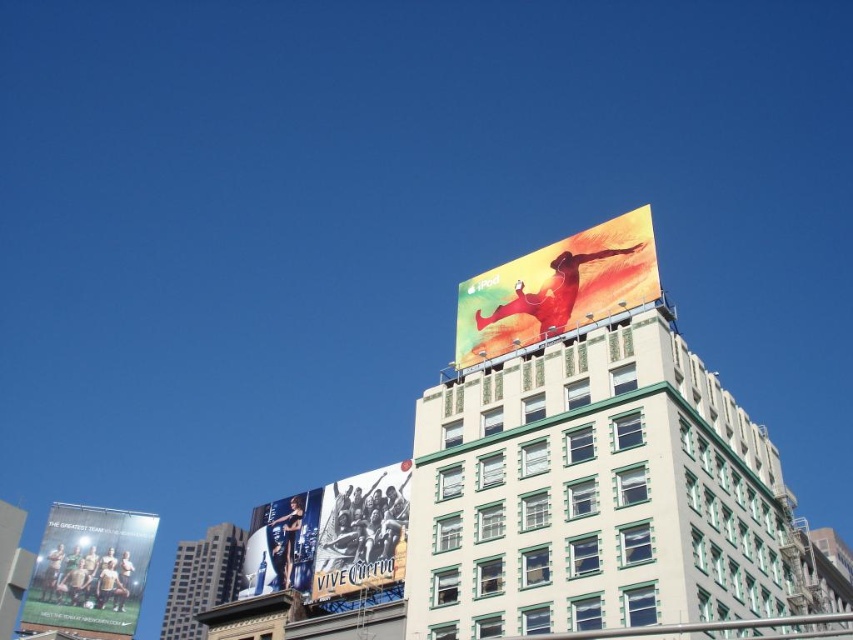
Question: Which point appears farthest from the camera in this image?

Choices:
 (A) (114, 563)
 (B) (676, 568)
 (C) (236, 552)
 (D) (257, 572)

Answer: (C)

Question: Is white concrete building at upper center closer to the viewer compared to matte white soccer team at lower left?

Choices:
 (A) no
 (B) yes

Answer: (B)

Question: Which point is farther to the camera?

Choices:
 (A) white concrete building at upper center
 (B) matte white soccer team at lower left
 (C) matte yellow poster at upper right

Answer: (B)

Question: Is matte white soccer team at lower left wider than dark gray concrete building at center?

Choices:
 (A) yes
 (B) no

Answer: (B)

Question: From the image, what is the correct spatial relationship of white concrete building at upper center in relation to dark gray concrete building at center?

Choices:
 (A) left
 (B) right

Answer: (B)

Question: Which of these objects is positioned farthest from the metallic silver sign at center?

Choices:
 (A) dark gray concrete building at center
 (B) matte yellow poster at upper right
 (C) matte white soccer team at lower left
 (D) white concrete building at upper center

Answer: (A)